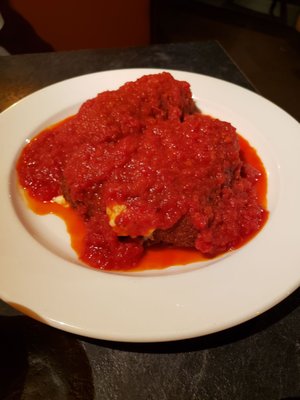
The height and width of the screenshot is (400, 300). I want to click on light reflecting off table, so click(x=5, y=97).